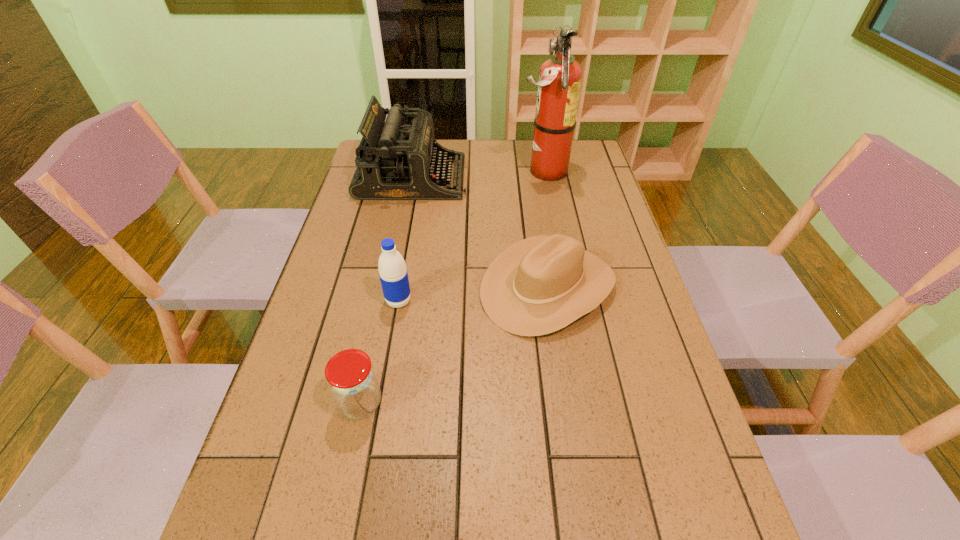
Find the location of a particular element. Image resolution: width=960 pixels, height=540 pixels. the tallest object is located at coordinates (560, 77).

I want to click on the fourth shortest object, so click(396, 160).

Identify the location of water bottle. (392, 269).

This screenshot has width=960, height=540. What are the coordinates of `cowboy hat` in the screenshot? It's located at (541, 284).

I want to click on jar, so click(352, 381).

Find the location of a particular element. Image resolution: width=960 pixels, height=540 pixels. free space located 0.160m from the nozzle of the tallest object is located at coordinates (472, 171).

Find the location of a particular element. free space located 0.060m from the nozzle of the tallest object is located at coordinates (500, 171).

Identify the location of free space located 0.060m from the nozzle of the tallest object. (500, 171).

Identify the location of vacant space located 0.230m on the keyboard of the typewriter. (533, 178).

Identify the location of free space located 0.160m on the right of the water bottle. (474, 301).